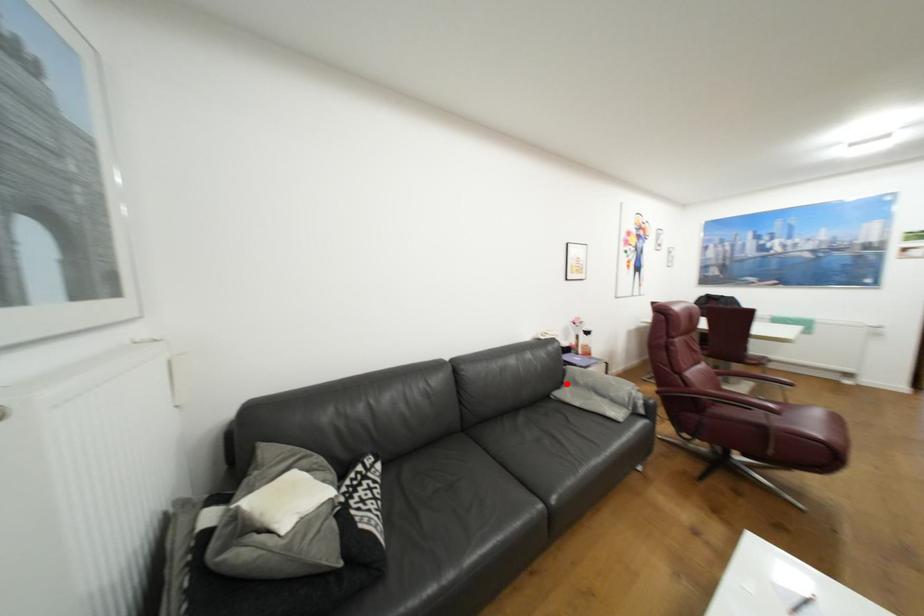
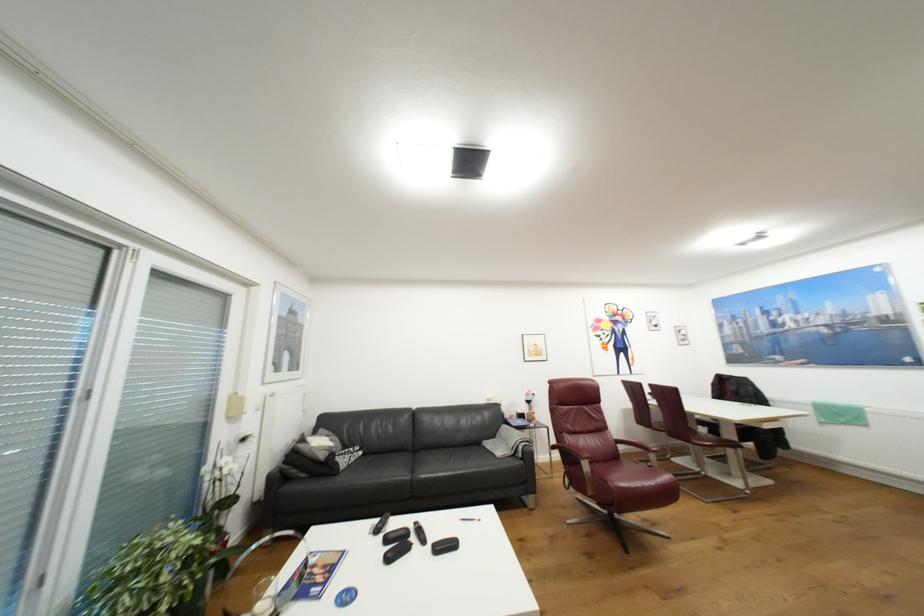
Question: I am providing you with two images of the same scene from different viewpoints. Given a red point in image1, look at the same physical point in image2. Is it:

Choices:
 (A) Closer to the viewpoint
 (B) Farther from the viewpoint

Answer: (B)